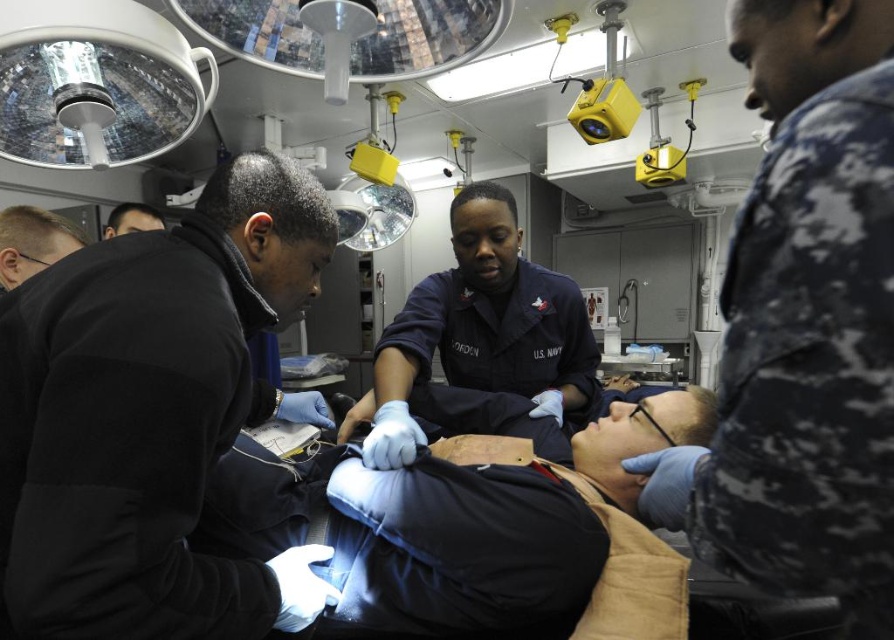
Can you confirm if camouflage uniform at center is positioned to the left of dark blue uniform at center?

No, camouflage uniform at center is not to the left of dark blue uniform at center.

Does camouflage uniform at center have a lesser width compared to dark blue uniform at center?

Yes.

Find the location of a particular element. This screenshot has width=894, height=640. camouflage uniform at center is located at coordinates (808, 317).

Is black matte jacket at left bigger than dark blue uniform at center?

No, black matte jacket at left is not bigger than dark blue uniform at center.

Is black matte jacket at left wider than dark blue uniform at center?

No, black matte jacket at left is not wider than dark blue uniform at center.

At what (x,y) coordinates should I click in order to perform the action: click on black matte jacket at left. Please return your answer as a coordinate pair (x, y). Image resolution: width=894 pixels, height=640 pixels. Looking at the image, I should click on 152,417.

Is black matte jacket at left smaller than camouflage uniform at center?

Actually, black matte jacket at left might be larger than camouflage uniform at center.

Who is more forward, [79,355] or [829,289]?

Point [829,289]

Identify the location of black matte jacket at left. (152, 417).

What are the coordinates of `black matte jacket at left` in the screenshot? It's located at (152, 417).